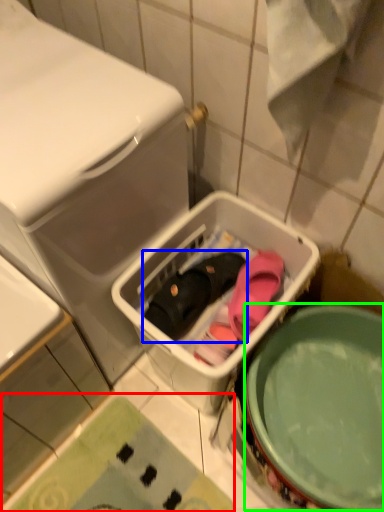
Question: Considering the real-world distances, which object is farthest from bath mat (highlighted by a red box)? footwear (highlighted by a blue box) or mixing bowl (highlighted by a green box)?

Choices:
 (A) footwear
 (B) mixing bowl

Answer: (A)